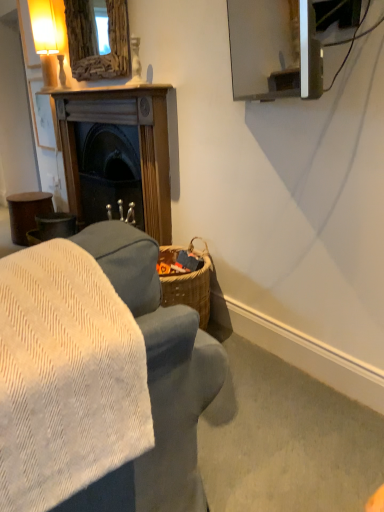
Question: Does point (109, 106) appear closer or farther from the camera than point (46, 35)?

Choices:
 (A) closer
 (B) farther

Answer: (A)

Question: Is wooden fireplace at left spatially inside matte glass table lamp at upper left, or outside of it?

Choices:
 (A) outside
 (B) inside

Answer: (A)

Question: Which object is the farthest from the wooden mirror at upper center?

Choices:
 (A) velvet gray couch at lower left
 (B) wooden fireplace at left
 (C) matte glass table lamp at upper left

Answer: (A)

Question: Considering the real-world distances, which object is farthest from the wooden mirror at upper center?

Choices:
 (A) velvet gray couch at lower left
 (B) wooden fireplace at left
 (C) matte glass table lamp at upper left

Answer: (A)